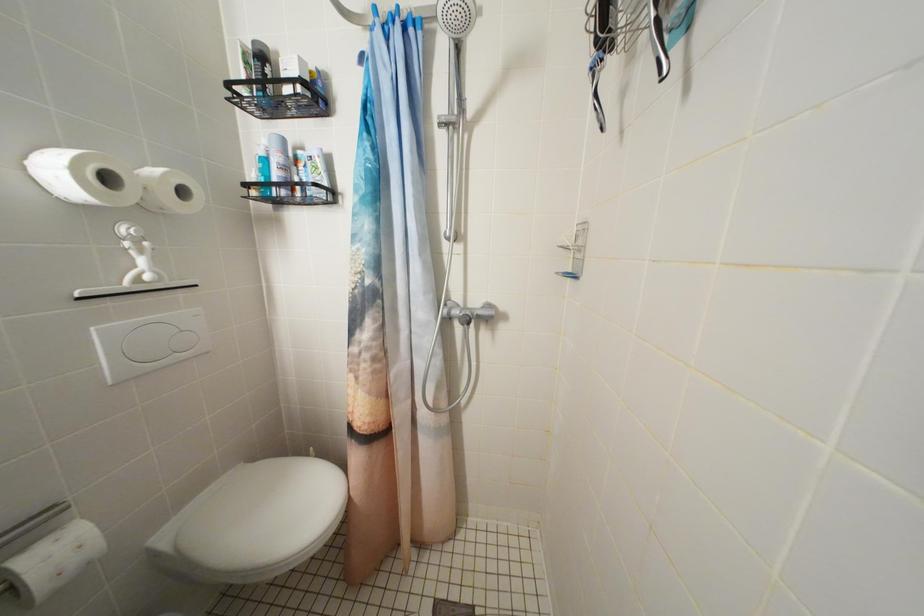
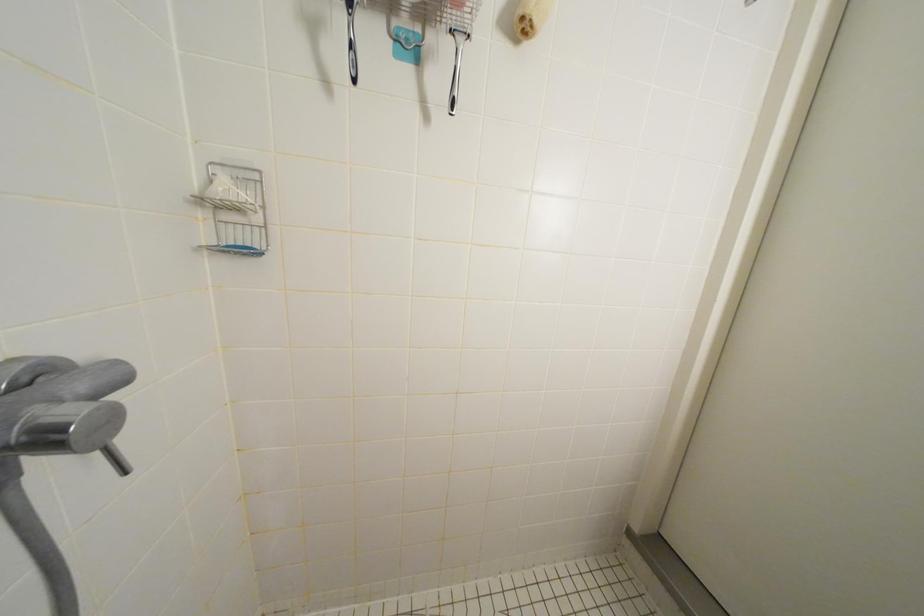
The images are taken continuously from a first-person perspective. In which direction is your viewpoint rotating?

The camera rotated toward right-down.